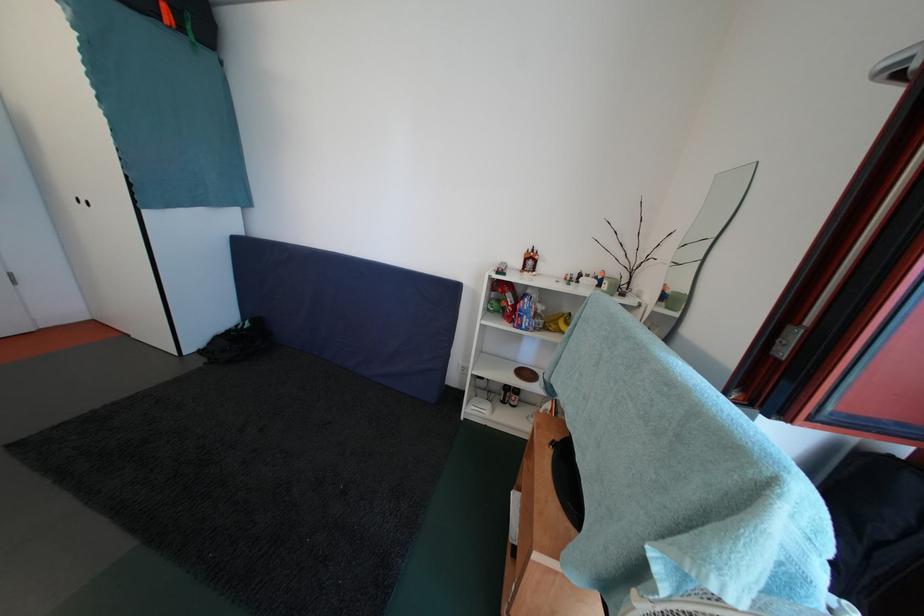
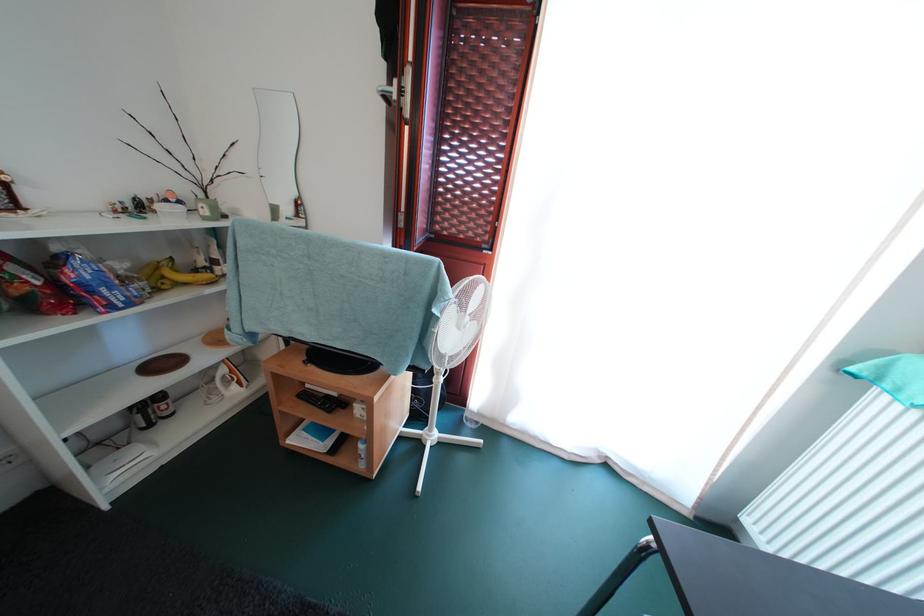
Where in the second image is the point corresponding to (x=515, y=307) from the first image?

(34, 286)